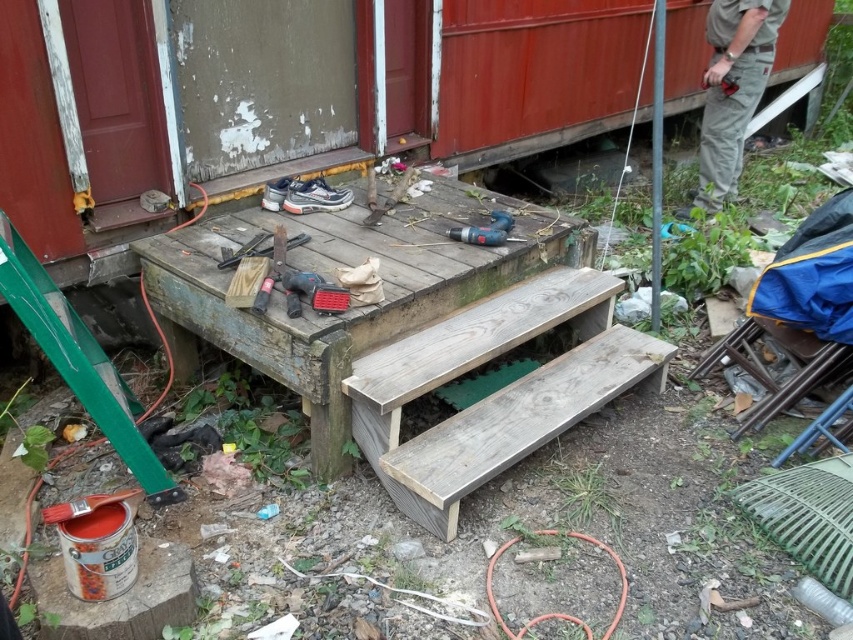
Which is in front, point (432, 314) or point (498, 221)?

Point (432, 314)

Which of these two, weathered wood picnic table at center or blue plastic drill at center, stands taller?

weathered wood picnic table at center is taller.

Locate an element on the screen. The width and height of the screenshot is (853, 640). weathered wood picnic table at center is located at coordinates (352, 307).

Describe the element at coordinates (352, 307) in the screenshot. This screenshot has height=640, width=853. I see `weathered wood picnic table at center` at that location.

From the picture: Who is taller, weathered wood picnic table at center or weathered wood bench at center?

weathered wood picnic table at center

Who is more distant from viewer, (277, 308) or (438, 440)?

The point (438, 440) is more distant.

The image size is (853, 640). I want to click on weathered wood picnic table at center, so click(x=352, y=307).

How distant is weathered wood bench at center from khaki cotton pants at right?

They are 2.01 meters apart.

Is weathered wood bench at center taller than khaki cotton pants at right?

No, weathered wood bench at center is not taller than khaki cotton pants at right.

Is point (409, 461) closer to viewer compared to point (721, 28)?

Yes.

This screenshot has height=640, width=853. Identify the location of weathered wood bench at center. coord(496,390).